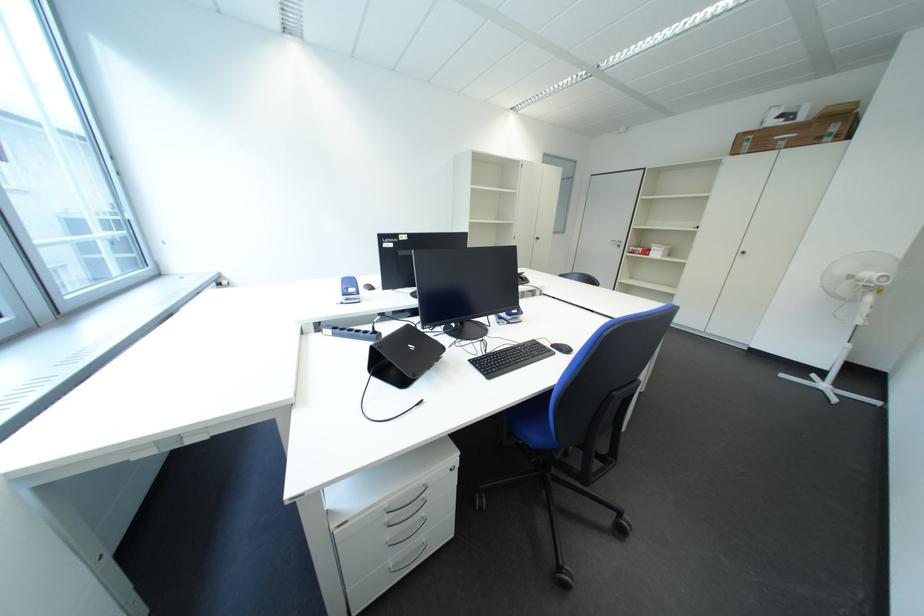
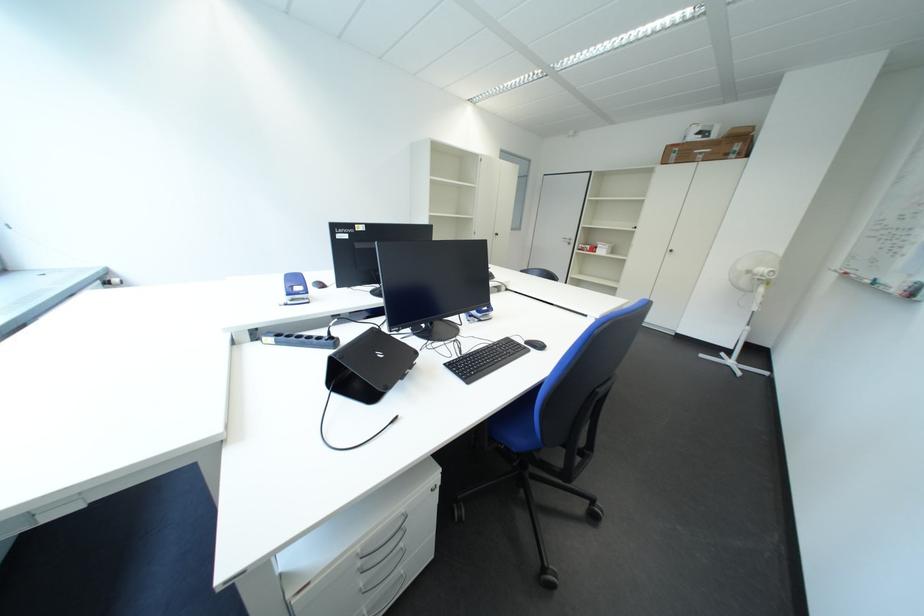
Locate, in the second image, the point that corresponds to (356,298) in the first image.

(300, 297)